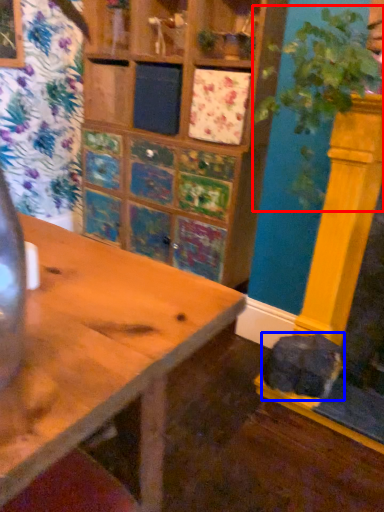
Question: Which object appears farthest to the camera in this image, plant (highlighted by a red box) or animal (highlighted by a blue box)?

Choices:
 (A) plant
 (B) animal

Answer: (B)